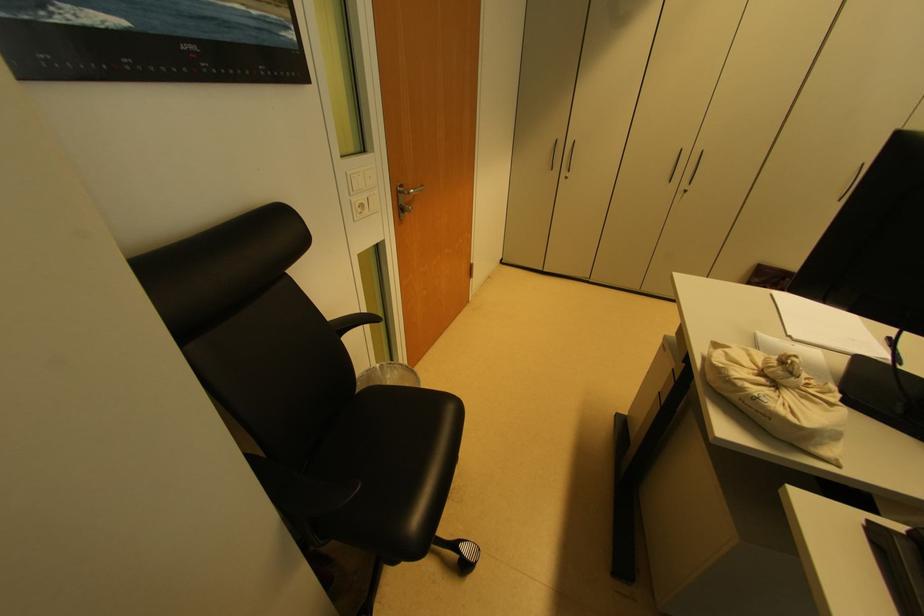
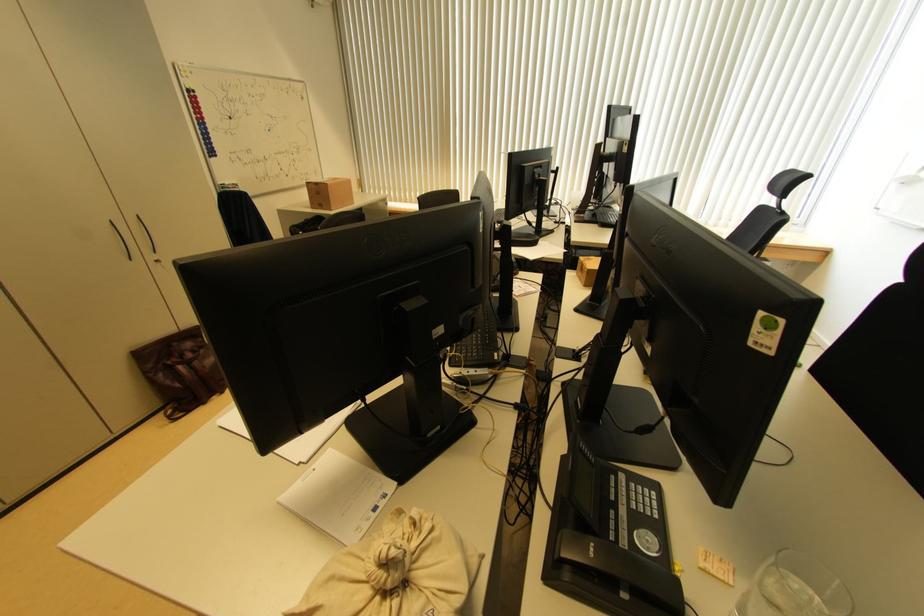
Locate, in the second image, the point that corresponds to (763,378) in the first image.

(387, 597)